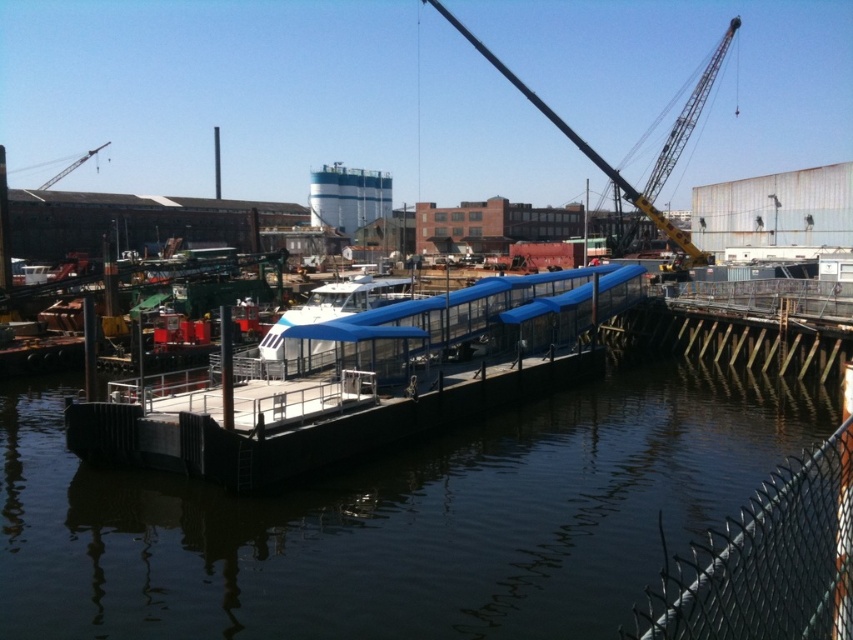
Question: Does transparent water at center have a greater width compared to metallic yellow crane at upper left?

Choices:
 (A) no
 (B) yes

Answer: (A)

Question: In this image, where is blue tarpaulin boat at center located relative to metallic yellow crane at upper right?

Choices:
 (A) below
 (B) above

Answer: (A)

Question: Is transparent water at center thinner than metallic yellow crane at upper left?

Choices:
 (A) no
 (B) yes

Answer: (B)

Question: Based on their relative distances, which object is farther from the black chain-link fence at lower right?

Choices:
 (A) metallic yellow crane at upper left
 (B) metallic yellow crane at upper right

Answer: (A)

Question: Which point is closer to the camera?

Choices:
 (A) metallic yellow crane at upper right
 (B) transparent water at center

Answer: (B)

Question: Which of the following is the closest to the observer?

Choices:
 (A) blue tarpaulin boat at center
 (B) metallic yellow crane at upper left
 (C) transparent water at center

Answer: (C)